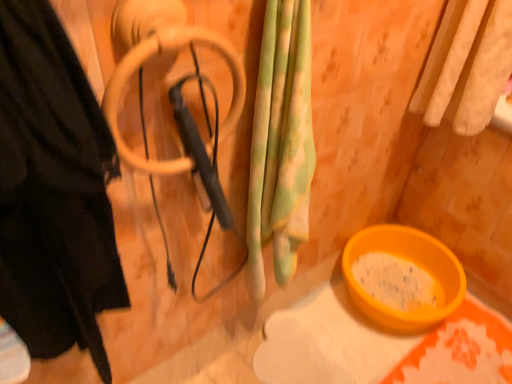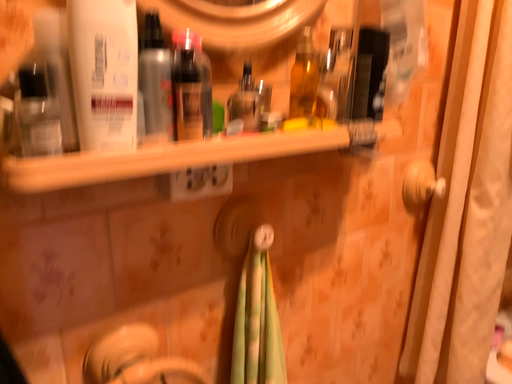
Question: Which way did the camera rotate in the video?

Choices:
 (A) rotated downward
 (B) rotated upward

Answer: (B)